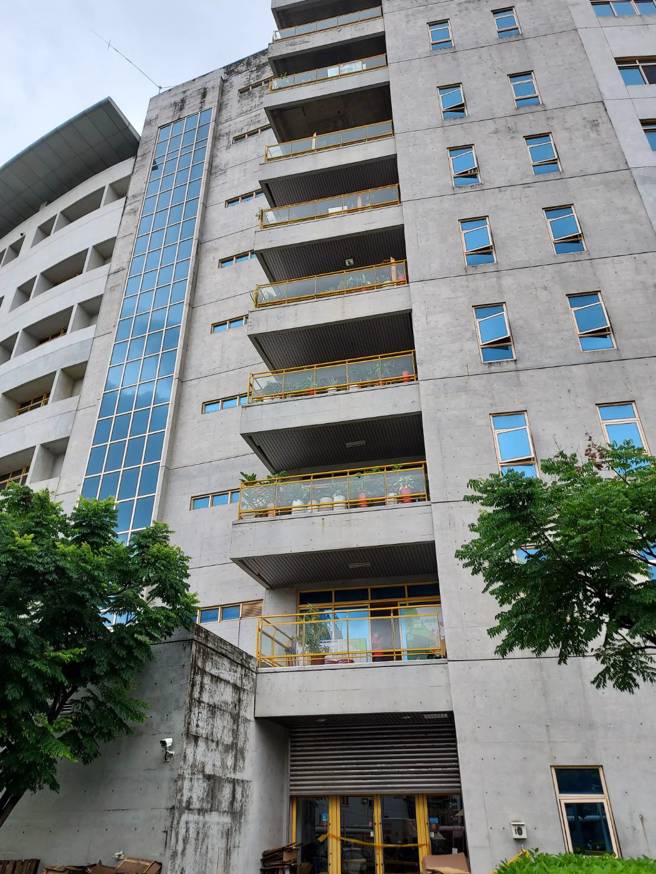
You are a GUI agent. You are given a task and a screenshot of the screen. Output one action in this format:
    pyautogui.click(x=<x>, y=<y>)
    Task: Click on the glass doors
    The height and width of the screenshot is (874, 656).
    Given the screenshot: What is the action you would take?
    pyautogui.click(x=309, y=820), pyautogui.click(x=361, y=820), pyautogui.click(x=397, y=820), pyautogui.click(x=443, y=824), pyautogui.click(x=582, y=822)